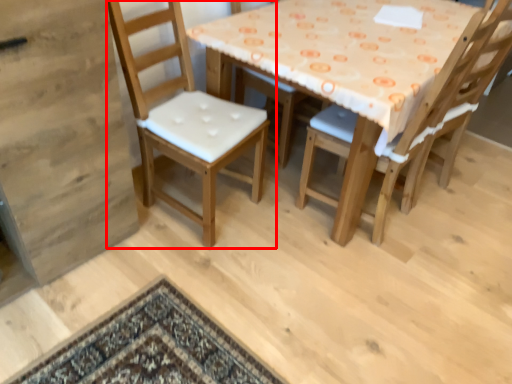
Question: Observing the image, what is the correct spatial positioning of chair (annotated by the red box) in reference to chair?

Choices:
 (A) right
 (B) left

Answer: (B)